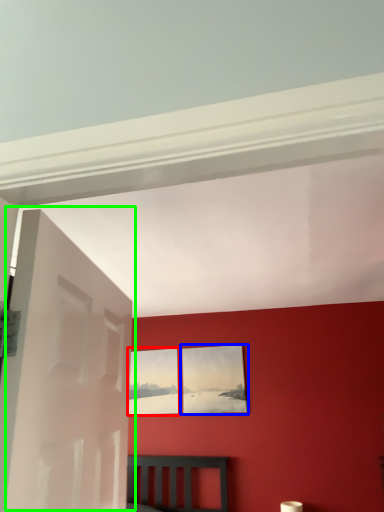
Question: Which object is positioned farthest from picture frame (highlighted by a red box)? Select from picture frame (highlighted by a blue box) and door (highlighted by a green box).

Choices:
 (A) picture frame
 (B) door

Answer: (B)